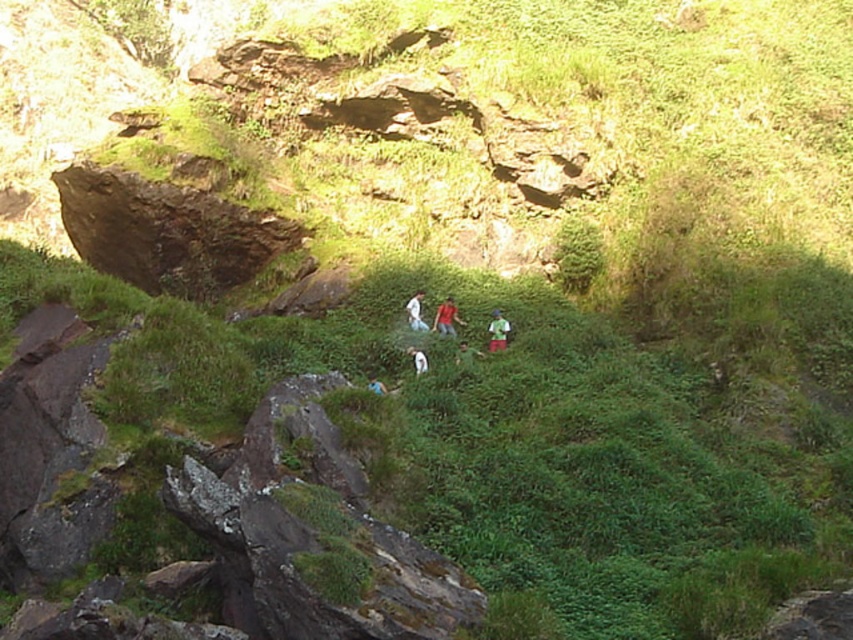
Is point (415, 300) closer to viewer compared to point (422, 358)?

No.

Find the location of a particular element. This screenshot has width=853, height=640. white matte shirt at center is located at coordinates (415, 312).

Does red fabric shirt at center have a greater width compared to white matte shirt at center?

Indeed, red fabric shirt at center has a greater width compared to white matte shirt at center.

Locate an element on the screen. red fabric shirt at center is located at coordinates pyautogui.click(x=445, y=317).

You are a GUI agent. You are given a task and a screenshot of the screen. Output one action in this format:
    pyautogui.click(x=<x>, y=<y>)
    Task: Click on the red fabric shirt at center
    This screenshot has height=640, width=853.
    Given the screenshot: What is the action you would take?
    pyautogui.click(x=445, y=317)

Who is more distant from viewer, [447,332] or [381,388]?

The point [447,332] is more distant.

This screenshot has width=853, height=640. What are the coordinates of `red fabric shirt at center` in the screenshot? It's located at (445, 317).